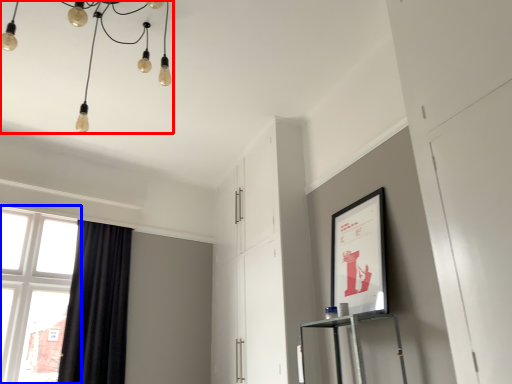
Question: Among these objects, which one is nearest to the camera, lamp (highlighted by a red box) or window (highlighted by a blue box)?

Choices:
 (A) lamp
 (B) window

Answer: (A)